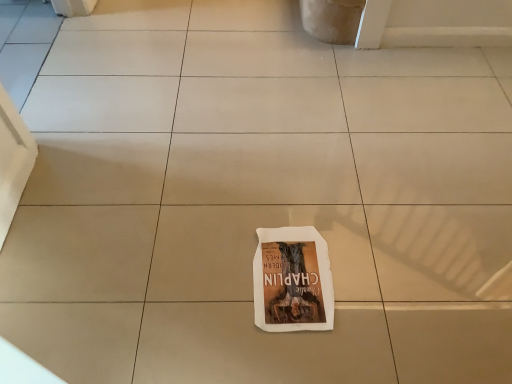
The width and height of the screenshot is (512, 384). I want to click on empty space that is ontop of white paper magazine at center (from a real-world perspective), so click(x=291, y=270).